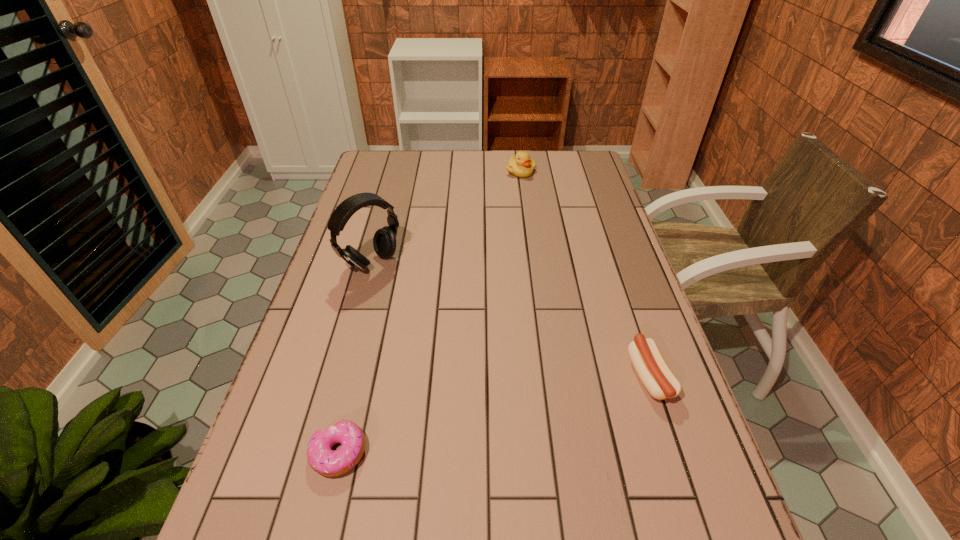
What are the coordinates of `object present at the right edge` in the screenshot? It's located at (650, 366).

Find the location of a particular element. object present at the near left corner is located at coordinates click(x=322, y=459).

At what (x,y) coordinates should I click in order to perform the action: click on vacant area at the near edge. Please return your answer as a coordinate pair (x, y). The height and width of the screenshot is (540, 960). Looking at the image, I should click on (557, 472).

Where is `free space at the left edge`? The width and height of the screenshot is (960, 540). free space at the left edge is located at coordinates (276, 395).

This screenshot has height=540, width=960. Find the location of `free space at the far left corner of the desktop`. free space at the far left corner of the desktop is located at coordinates (380, 177).

Identify the location of vacant space at the far right corner of the desktop. The height and width of the screenshot is (540, 960). (595, 173).

The height and width of the screenshot is (540, 960). In order to click on vacant space at the near right corner in this screenshot , I will do `click(715, 498)`.

What are the coordinates of `unoccupied area between the second object from right to left and the doughnut` in the screenshot? It's located at (430, 312).

Where is `free space that is in between the tallest object and the rightmost object`? Image resolution: width=960 pixels, height=540 pixels. free space that is in between the tallest object and the rightmost object is located at coordinates (x=511, y=320).

You are a GUI agent. You are given a task and a screenshot of the screen. Output one action in this format:
    pyautogui.click(x=<x>, y=<y>)
    Task: Click on the blank region between the farthest object and the tallest object
    
    Given the screenshot: What is the action you would take?
    pyautogui.click(x=446, y=218)